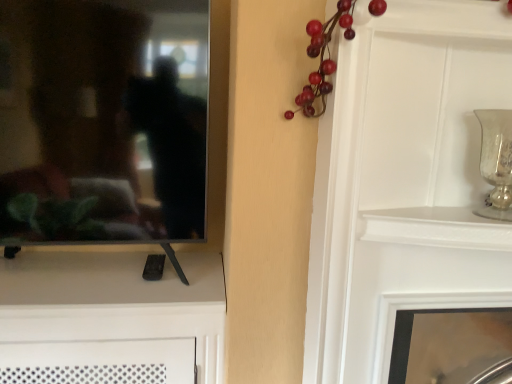
Question: Does silver textured vase at upper right have a lesser width compared to black glossy mirror at left?

Choices:
 (A) no
 (B) yes

Answer: (B)

Question: Considering the relative sizes of silver textured vase at upper right and black glossy mirror at left in the image provided, is silver textured vase at upper right smaller than black glossy mirror at left?

Choices:
 (A) yes
 (B) no

Answer: (A)

Question: Is silver textured vase at upper right oriented towards black glossy mirror at left?

Choices:
 (A) yes
 (B) no

Answer: (B)

Question: Is silver textured vase at upper right bigger than black glossy mirror at left?

Choices:
 (A) yes
 (B) no

Answer: (B)

Question: Is silver textured vase at upper right taller than black glossy mirror at left?

Choices:
 (A) no
 (B) yes

Answer: (A)

Question: In terms of width, does black glossy mirror at left look wider or thinner when compared to silver textured vase at upper right?

Choices:
 (A) wide
 (B) thin

Answer: (A)

Question: From the image's perspective, is black glossy mirror at left positioned above or below silver textured vase at upper right?

Choices:
 (A) above
 (B) below

Answer: (A)

Question: In terms of height, does black glossy mirror at left look taller or shorter compared to silver textured vase at upper right?

Choices:
 (A) tall
 (B) short

Answer: (A)

Question: Considering their positions, is black glossy mirror at left located in front of or behind silver textured vase at upper right?

Choices:
 (A) behind
 (B) front

Answer: (A)

Question: From a real-world perspective, is silver textured vase at upper right positioned above or below black glossy mirror at left?

Choices:
 (A) above
 (B) below

Answer: (B)

Question: Is silver textured vase at upper right inside the boundaries of black glossy mirror at left, or outside?

Choices:
 (A) outside
 (B) inside

Answer: (A)

Question: Considering the positions of silver textured vase at upper right and black glossy mirror at left in the image, is silver textured vase at upper right wider or thinner than black glossy mirror at left?

Choices:
 (A) wide
 (B) thin

Answer: (B)

Question: From the image's perspective, is silver textured vase at upper right above or below black glossy mirror at left?

Choices:
 (A) below
 (B) above

Answer: (A)

Question: From the image's perspective, is white glossy fireplace at lower right located above or below silver textured vase at upper right?

Choices:
 (A) below
 (B) above

Answer: (A)

Question: In terms of height, does white glossy fireplace at lower right look taller or shorter compared to silver textured vase at upper right?

Choices:
 (A) short
 (B) tall

Answer: (B)